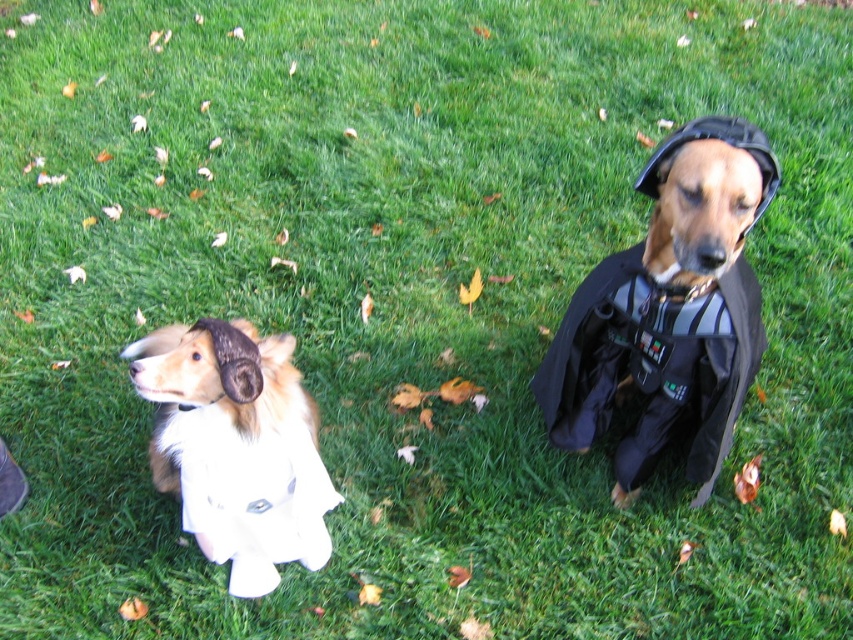
Question: Does shiny black cape at right appear over white fluffy dog at left?

Choices:
 (A) no
 (B) yes

Answer: (B)

Question: Can you confirm if shiny black cape at right is positioned below white fluffy dog at left?

Choices:
 (A) yes
 (B) no

Answer: (B)

Question: Does shiny black cape at right appear over white fluffy dog at left?

Choices:
 (A) no
 (B) yes

Answer: (B)

Question: Which point is closer to the camera?

Choices:
 (A) (201, 458)
 (B) (763, 339)

Answer: (A)

Question: Which object is farther from the camera taking this photo?

Choices:
 (A) shiny black cape at right
 (B) white fluffy dog at left

Answer: (B)